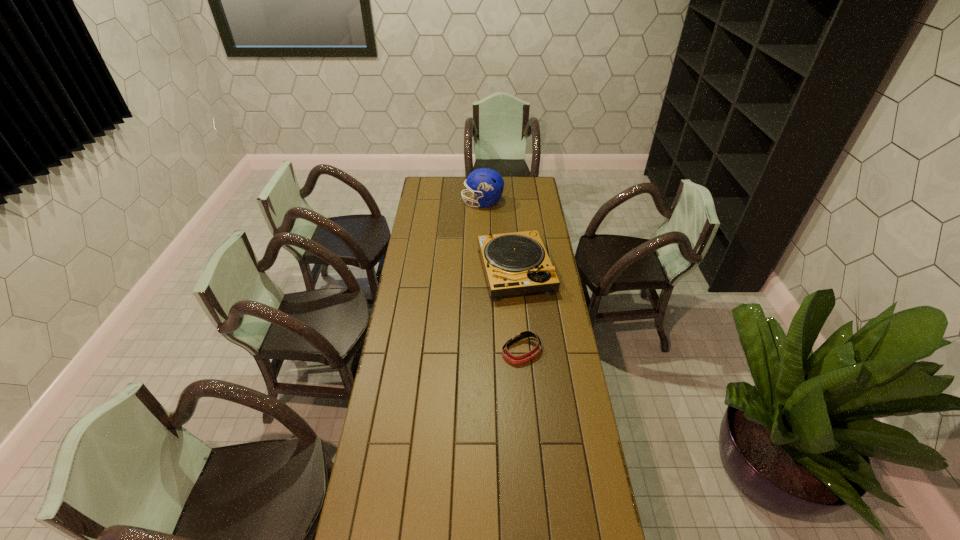
Find the location of `object at the far edge`. object at the far edge is located at coordinates (486, 183).

Locate an element on the screen. record player that is positioned at the right edge is located at coordinates (516, 263).

Locate an element on the screen. dog collar that is at the right edge is located at coordinates (519, 336).

In the image, there is a desktop. Where is `vacant space at the far edge`? vacant space at the far edge is located at coordinates (510, 191).

Find the location of a particular element. Image resolution: width=960 pixels, height=540 pixels. vacant area at the left edge of the desktop is located at coordinates (419, 320).

Identify the location of free location at the right edge of the desktop. pos(543,217).

In the image, there is a desktop. What are the coordinates of `free region at the far left corner` in the screenshot? It's located at (440, 192).

Find the location of `object that is the second nearest to the second farthest object`. object that is the second nearest to the second farthest object is located at coordinates click(486, 183).

The height and width of the screenshot is (540, 960). Identify the location of object that stands as the closest to the dog collar. (516, 263).

Image resolution: width=960 pixels, height=540 pixels. I want to click on vacant space that satisfies the following two spatial constraints: 1. on the front-facing side of the farthest object; 2. on the left side of the dog collar, so click(484, 351).